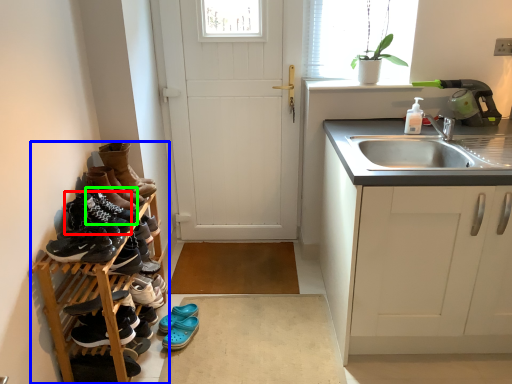
Question: Which object is the closest to the footwear (highlighted by a red box)? Choose among these: carpetry (highlighted by a blue box) or shoe (highlighted by a green box).

Choices:
 (A) carpetry
 (B) shoe

Answer: (B)